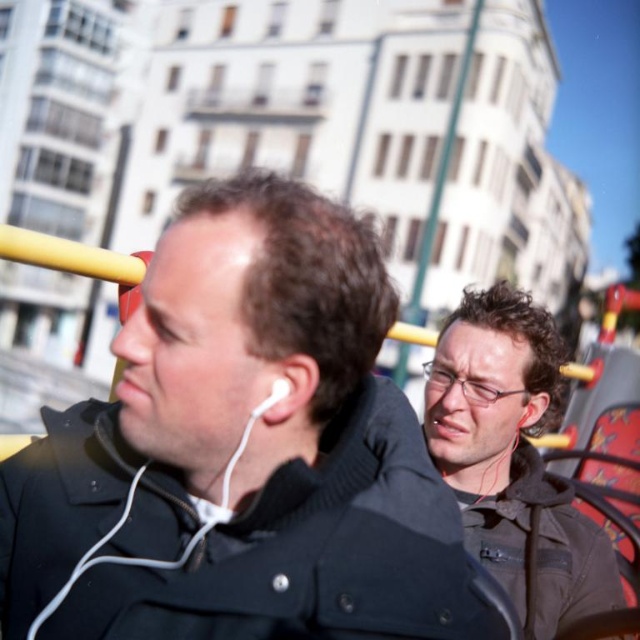
Question: Which object is farther from the camera taking this photo?

Choices:
 (A) matte black jacket at center
 (B) red fabric chair at right
 (C) white earbud at left

Answer: (B)

Question: Considering the real-world distances, which object is closest to the white earbud at left?

Choices:
 (A) black matte jacket at center
 (B) matte black jacket at center

Answer: (A)

Question: Which point is closer to the camera?

Choices:
 (A) (163, 531)
 (B) (429, 454)

Answer: (A)

Question: From the image, what is the correct spatial relationship of matte black jacket at center in relation to red fabric chair at right?

Choices:
 (A) above
 (B) below

Answer: (A)

Question: Is black matte jacket at center thinner than red fabric chair at right?

Choices:
 (A) no
 (B) yes

Answer: (A)

Question: From the image, what is the correct spatial relationship of matte black jacket at center in relation to white earbud at left?

Choices:
 (A) right
 (B) left

Answer: (A)